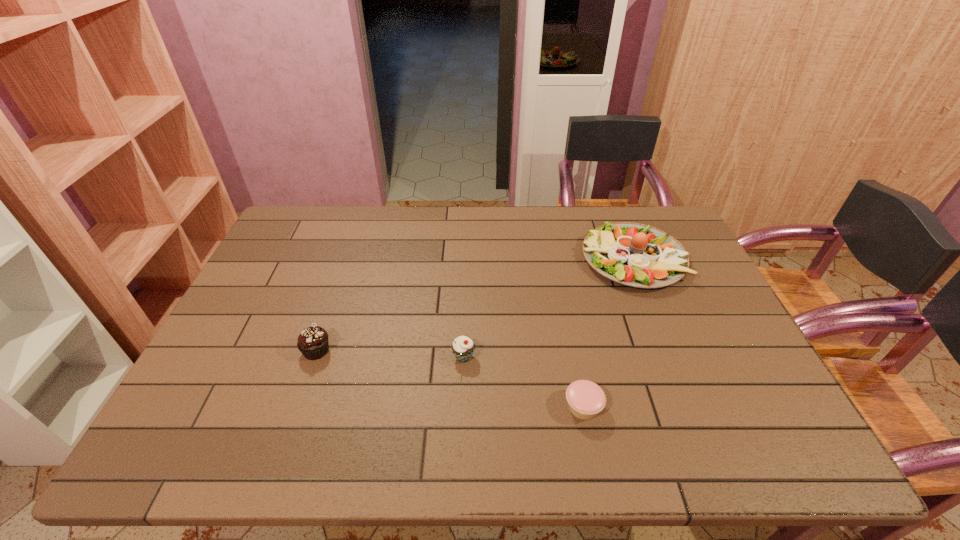
Identify the location of vacant area that lies between the farthest object and the shortest object. This screenshot has width=960, height=540. (608, 333).

The height and width of the screenshot is (540, 960). I want to click on free space between the leftmost cupcake and the second cupcake from left to right, so click(x=390, y=354).

Find the location of a particular element. Image resolution: width=960 pixels, height=540 pixels. blank region between the third object from right to left and the rightmost object is located at coordinates (548, 308).

Locate an element on the screen. vacant point located between the salad plate and the second cupcake from left to right is located at coordinates (548, 308).

Where is `free area in between the farthest object and the leftmost object`? The image size is (960, 540). free area in between the farthest object and the leftmost object is located at coordinates (474, 305).

Where is `unoccupied area between the leftmost cupcake and the second object from left to right`? The width and height of the screenshot is (960, 540). unoccupied area between the leftmost cupcake and the second object from left to right is located at coordinates (390, 354).

Identify the location of free area in between the rightmost object and the second cupcake from left to right. (548, 308).

Find the location of a particular element. The width and height of the screenshot is (960, 540). free space between the farthest object and the second cupcake from right to left is located at coordinates (548, 308).

Where is `the third closest object to the farthest object`? This screenshot has width=960, height=540. the third closest object to the farthest object is located at coordinates (313, 343).

Find the location of a particular element. This screenshot has height=540, width=960. object that can be found as the closest to the salad plate is located at coordinates (586, 399).